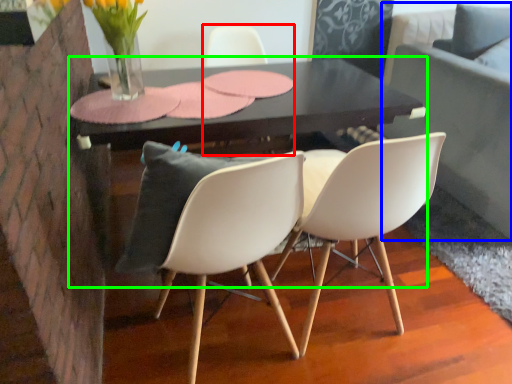
Question: Which object is positioned farthest from chair (highlighted by a red box)? Select from couch (highlighted by a blue box) and table (highlighted by a green box).

Choices:
 (A) couch
 (B) table

Answer: (A)